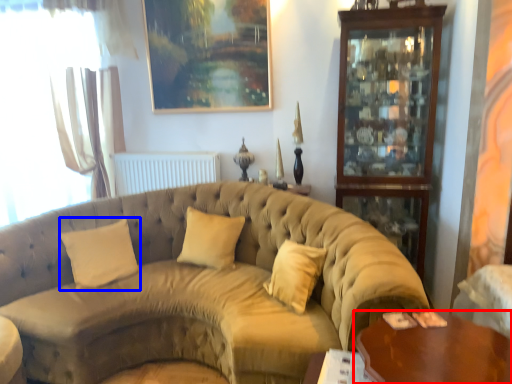
Question: Which point is closer to the camera, table (highlighted by a red box) or pillow (highlighted by a blue box)?

Choices:
 (A) table
 (B) pillow

Answer: (A)